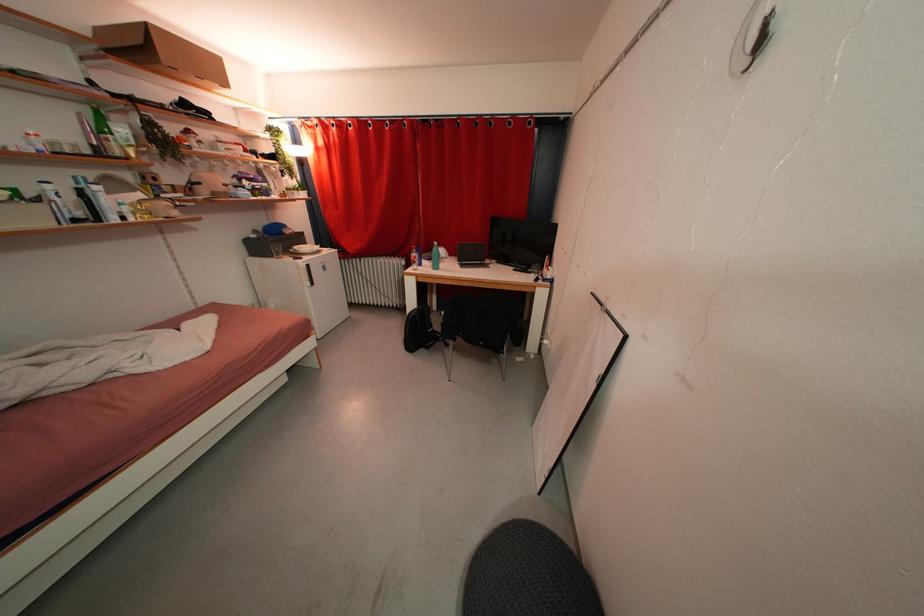
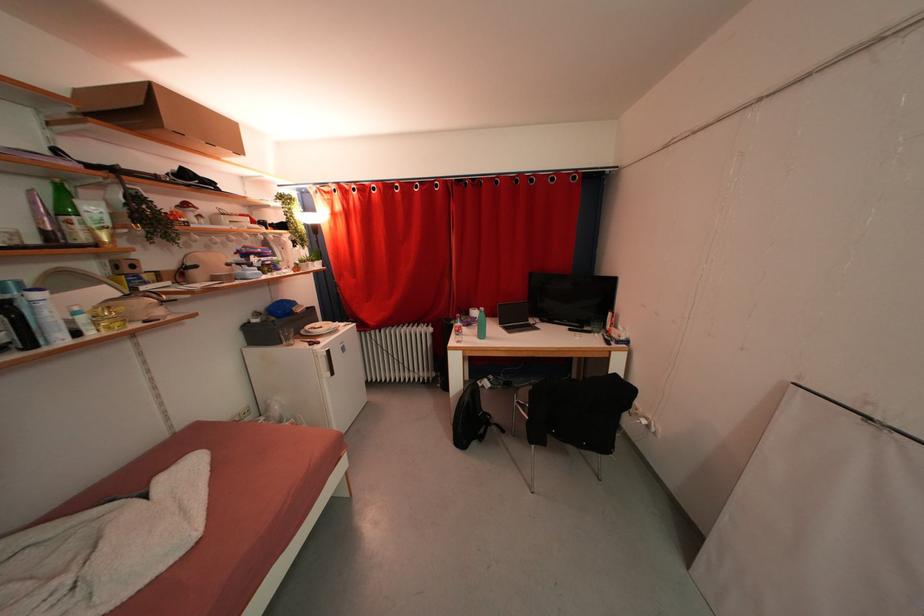
Find the pixel in the second image that matches (x=181, y=217) in the first image.

(165, 315)